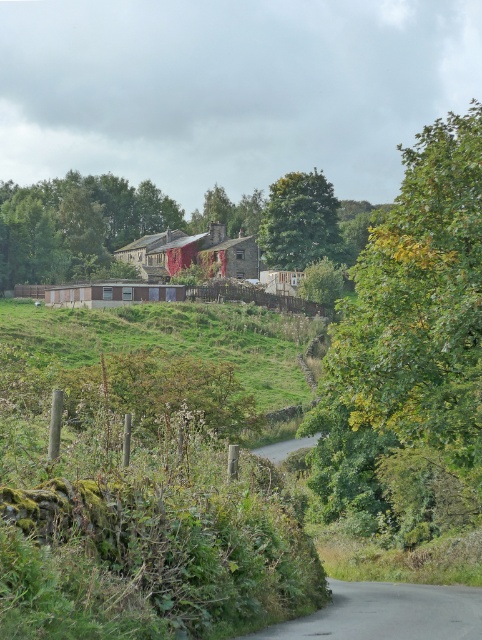
Is green grassy hillside at center positioned before green leafy tree at upper center?

Yes, it is in front of green leafy tree at upper center.

Describe the element at coordinates (176, 339) in the screenshot. I see `green grassy hillside at center` at that location.

Is point (148, 308) positioned in front of point (307, 253)?

Yes, point (148, 308) is closer to viewer.

You are a GUI agent. You are given a task and a screenshot of the screen. Output one action in this format:
    pyautogui.click(x=<x>, y=<y>)
    Task: Click on the green grassy hillside at center
    
    Given the screenshot: What is the action you would take?
    pyautogui.click(x=176, y=339)

Does green leafy tree at upper left appear under green leafy tree at upper center?

Incorrect, green leafy tree at upper left is not positioned below green leafy tree at upper center.

Is point (117, 234) positioned behind point (305, 209)?

That is True.

What do you see at coordinates (75, 225) in the screenshot? The image size is (482, 640). I see `green leafy tree at upper left` at bounding box center [75, 225].

Image resolution: width=482 pixels, height=640 pixels. Identify the location of green leafy tree at upper left. (75, 225).

Can you confirm if green grassy hillside at center is positioned below green leafy tree at upper left?

Yes.

Is point (94, 362) closer to camera compared to point (115, 184)?

Yes, it is.

You are a GUI agent. You are given a task and a screenshot of the screen. Output one action in this format:
    pyautogui.click(x=<x>, y=<y>)
    Task: Click on the green grassy hillside at center
    
    Given the screenshot: What is the action you would take?
    pyautogui.click(x=176, y=339)